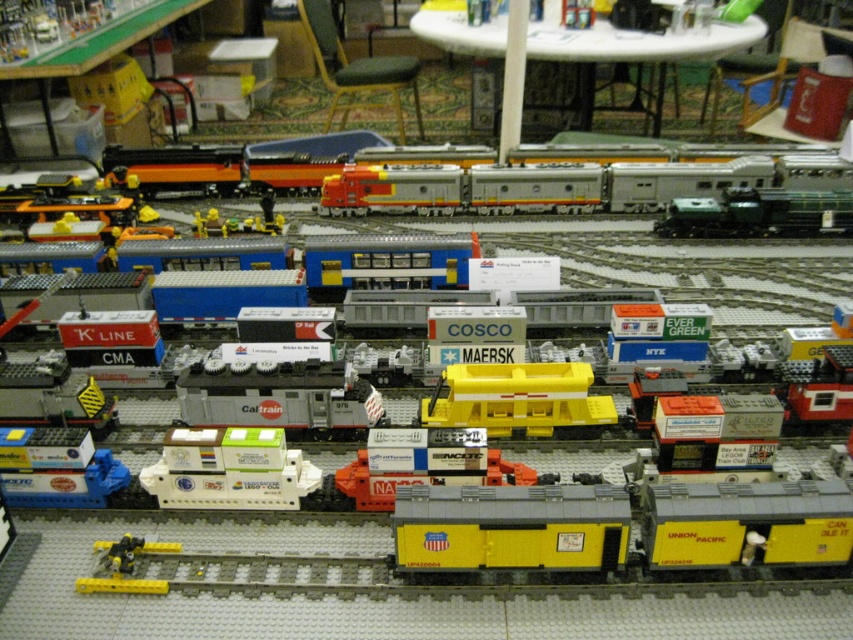
Question: Is metallic silver train at center thinner than matte gray container at center?

Choices:
 (A) no
 (B) yes

Answer: (A)

Question: Which of these objects is positioned farthest from the matte gray container at center?

Choices:
 (A) yellow plastic train car at lower left
 (B) metallic silver train at center
 (C) blue plastic train car at lower left
 (D) white matte container at center

Answer: (B)

Question: Is metallic silver train at center to the right of yellow plastic train car at lower left from the viewer's perspective?

Choices:
 (A) no
 (B) yes

Answer: (B)

Question: Where is white matte container at center located in relation to yellow plastic train car at lower left in the image?

Choices:
 (A) below
 (B) above

Answer: (B)

Question: Which point appears closest to the camera in this image?

Choices:
 (A) (815, 413)
 (B) (270, 508)
 (C) (135, 538)
 (D) (550, 188)

Answer: (C)

Question: Estimate the real-world distances between objects in this image. Which object is farther from the metallic silver train at center?

Choices:
 (A) yellow plastic train car at lower left
 (B) blue plastic train car at lower left
 (C) white matte container at center

Answer: (A)